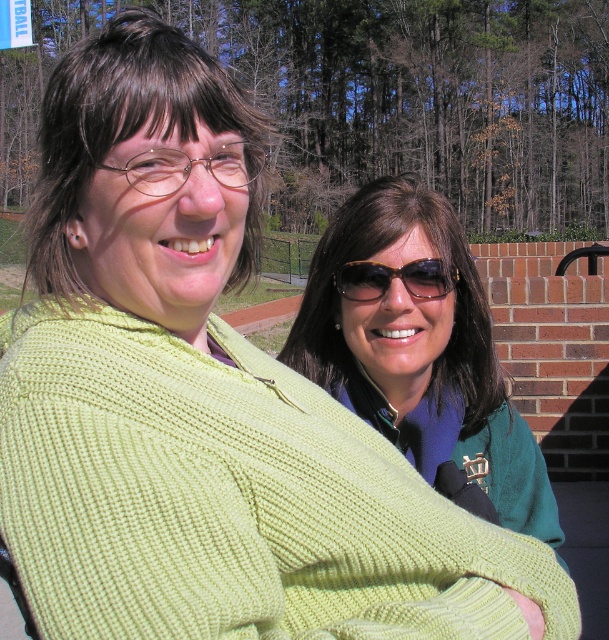
Find the location of `green knitted sweater at center`. green knitted sweater at center is located at coordinates (420, 352).

Is point (392, 280) positioned in front of point (345, 284)?

Yes.

Locate an element on the screen. This screenshot has height=640, width=609. green knitted sweater at center is located at coordinates point(420,352).

This screenshot has width=609, height=640. In order to click on green knitted sweater at center in this screenshot , I will do [420, 352].